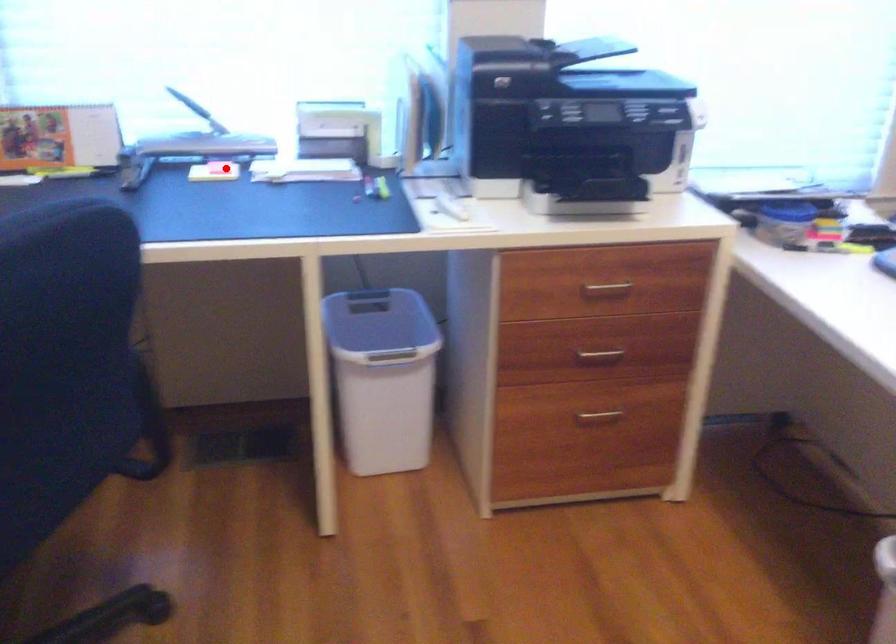
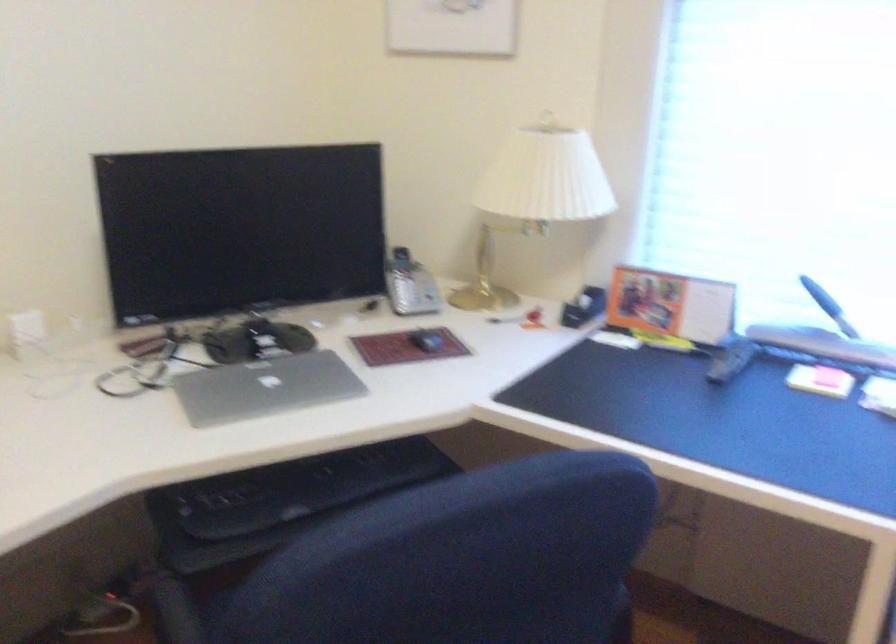
In the second image, find the point that corresponds to the highlighted location in the first image.

(829, 377)